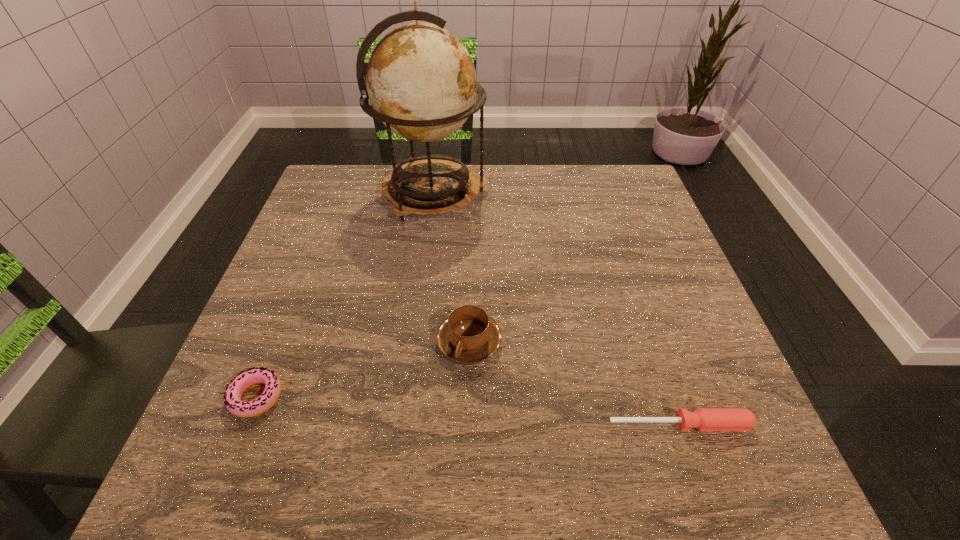
The height and width of the screenshot is (540, 960). Identify the location of free space between the second farthest object and the leftmost object. (363, 369).

Locate which object ranks second in proximity to the rightmost object. Please provide its 2D coordinates. Your answer should be formatted as a tuple, i.e. [(x, y)], where the tuple contains the x and y coordinates of a point satisfying the conditions above.

[(421, 81)]

At what (x,y) coordinates should I click in order to perform the action: click on object that is the nearest to the tallest object. Please return your answer as a coordinate pair (x, y). This screenshot has height=540, width=960. Looking at the image, I should click on (468, 335).

The image size is (960, 540). I want to click on vacant point that satisfies the following two spatial constraints: 1. on the side of the rightmost object with the handle; 2. on the right side of the second farthest object, so click(x=468, y=424).

Image resolution: width=960 pixels, height=540 pixels. What are the coordinates of `free location that satisfies the following two spatial constraints: 1. on the side of the third nearest object with the handle; 2. on the left side of the screwdriver` in the screenshot? It's located at (468, 424).

Locate an element on the screen. free point that satisfies the following two spatial constraints: 1. at the center of the rightmost object; 2. on the left side of the tallest object is located at coordinates (404, 424).

Where is `vacant space that satisfies the following two spatial constraints: 1. on the side of the rightmost object with the handle; 2. on the left side of the second tallest object`? vacant space that satisfies the following two spatial constraints: 1. on the side of the rightmost object with the handle; 2. on the left side of the second tallest object is located at coordinates (468, 424).